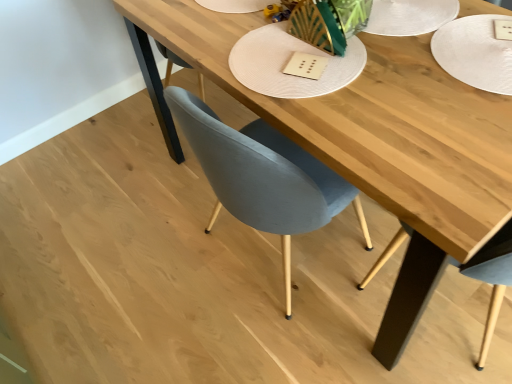
Identify the location of free space that is to the left of white textured placemat at upper right. (405, 95).